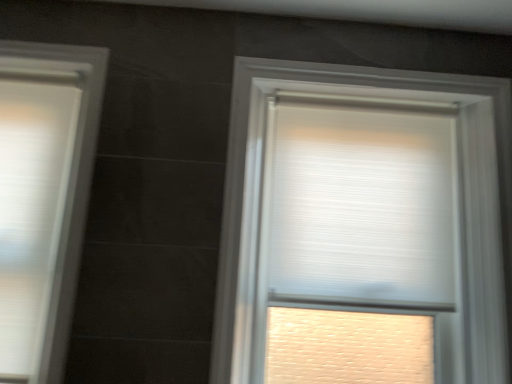
Question: Looking at their shapes, would you say white pleated blind at upper center is wider or thinner than white textured roller blind at center, arranged as the first window when viewed from the right?

Choices:
 (A) wide
 (B) thin

Answer: (B)

Question: From the image's perspective, is white pleated blind at upper center located above or below white textured roller blind at center, arranged as the first window when viewed from the right?

Choices:
 (A) above
 (B) below

Answer: (A)

Question: Which is farther from the white pleated blind at upper center?

Choices:
 (A) white textured roller blind at center, which is the second window from left to right
 (B) white matte window at left, acting as the first window starting from the left

Answer: (B)

Question: Which object is the farthest from the white matte window at left, which is the second window in right-to-left order?

Choices:
 (A) white pleated blind at upper center
 (B) white textured roller blind at center, arranged as the first window when viewed from the right

Answer: (A)